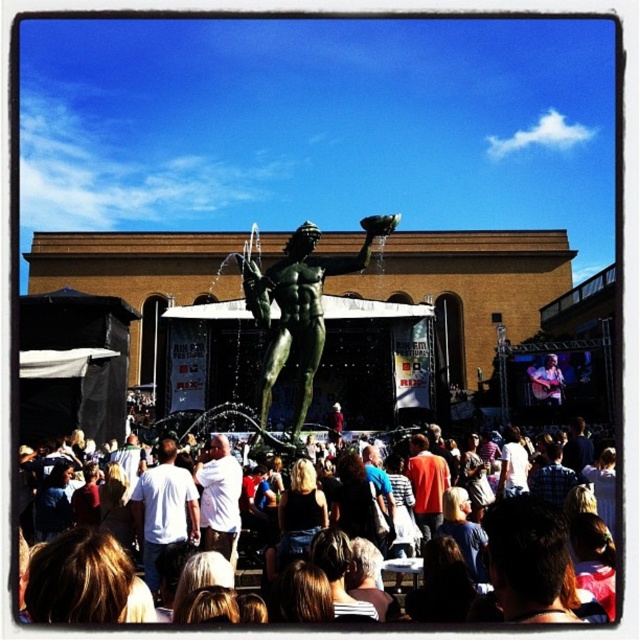
Looking at this image, you are a photographer at the festival and want to capture both the white matte shirt at center and the white cotton shirt at center in your photo. However, you notice that focusing on one makes the other blurry. Which shirt should you focus on to ensure the one closer to you stays sharp?

You should focus on the white matte shirt at center because it is in front of the white cotton shirt at center, making it closer to you. This ensures the white matte shirt at center will stay sharp while the background one may blur.

You are at the festival and want to take a photo of the multicolored fabric crowd at center. Where should you position yourself to capture them in the best way?

To capture the multicolored fabric crowd at center in the best way, position yourself at point (544, 564) where they are located.

You are a photographer trying to capture a photo of the bronze statue at center and the white cotton shirt at center. Which object should you focus on first if you want to ensure both are in the frame without moving the camera?

The bronze statue at center is wider than the white cotton shirt at center, so focusing on the bronze statue at center first will ensure both are in the frame since it occupies more space.